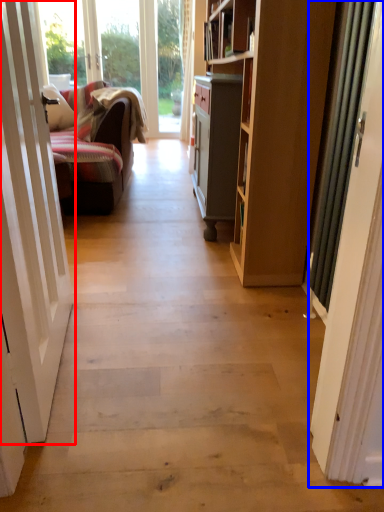
Question: Among these objects, which one is nearest to the camera, door (highlighted by a red box) or door (highlighted by a blue box)?

Choices:
 (A) door
 (B) door

Answer: (A)